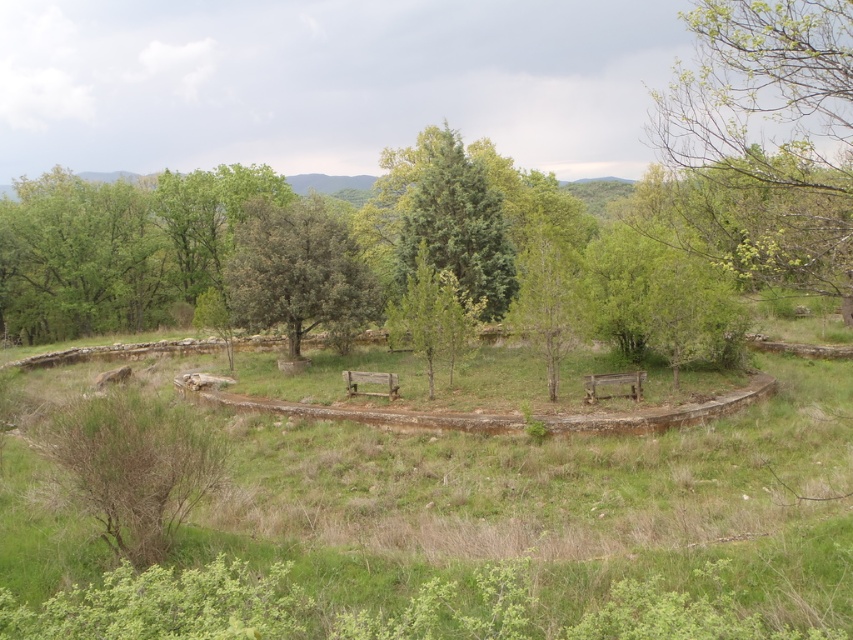
Question: Is green leafy tree at center thinner than green matte tree at center?

Choices:
 (A) yes
 (B) no

Answer: (B)

Question: Which of the following is the closest to the observer?

Choices:
 (A) (218, 440)
 (B) (383, 163)
 (C) (115, 200)
 (D) (735, 250)

Answer: (A)

Question: Based on their relative distances, which object is nearer to the green leafy tree at upper right?

Choices:
 (A) green textured tree at center
 (B) green leafy tree at center
 (C) green leafy tree at upper left
 (D) brown dry bush at lower left

Answer: (A)

Question: In this image, where is brown dry bush at lower left located relative to green matte tree at center?

Choices:
 (A) below
 (B) above

Answer: (A)

Question: Is green leafy tree at upper right above green leafy tree at center?

Choices:
 (A) no
 (B) yes

Answer: (B)

Question: Considering the real-world distances, which object is closest to the green matte tree at center?

Choices:
 (A) green leafy tree at upper left
 (B) green leafy tree at upper right
 (C) green leafy tree at center
 (D) brown dry bush at lower left

Answer: (C)